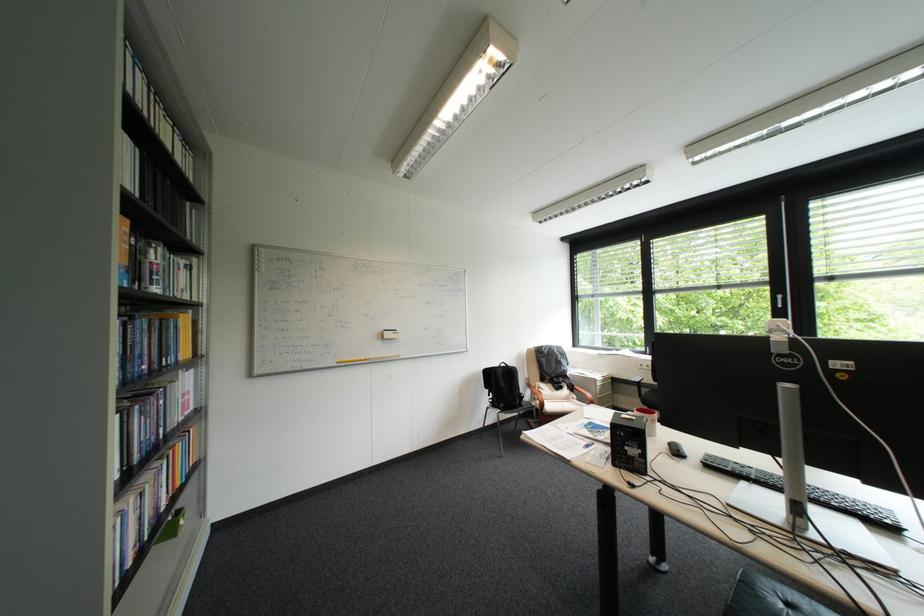
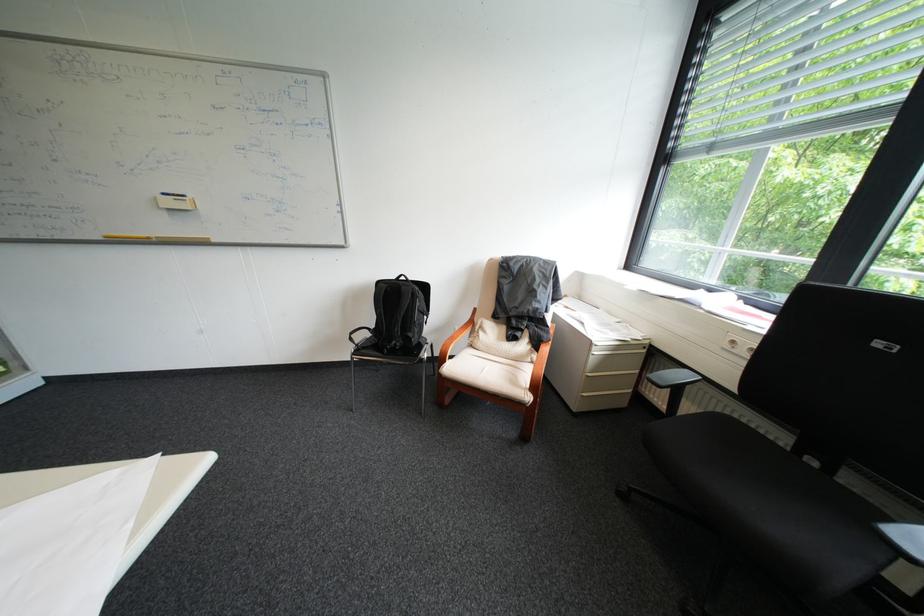
Where in the second image is the point corresponding to (397,331) from the first image?

(176, 195)